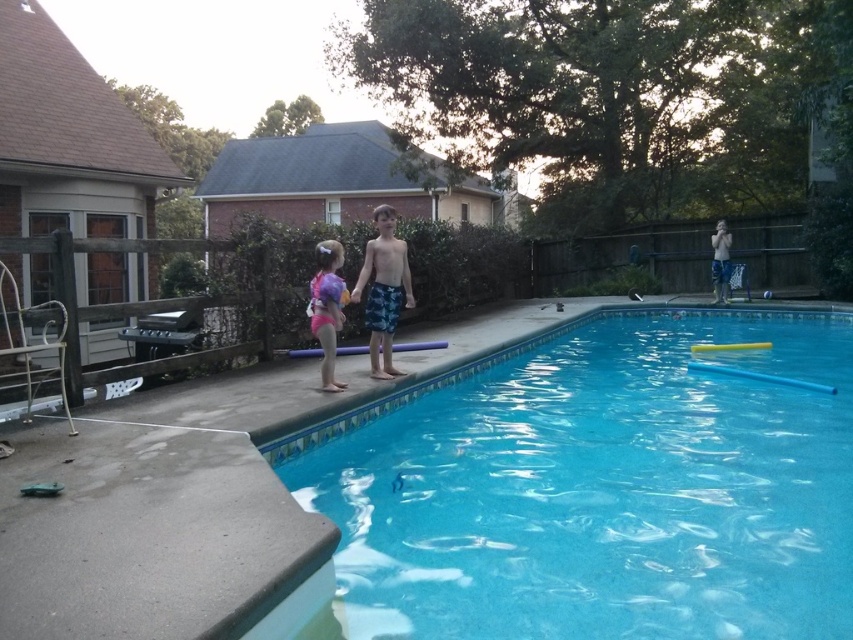
Question: Which object is closer to the camera taking this photo?

Choices:
 (A) pink fabric swimsuit at center
 (B) blue textured shorts at upper right

Answer: (A)

Question: Is the position of clear blue water at center less distant than that of pink fabric swimsuit at center?

Choices:
 (A) no
 (B) yes

Answer: (B)

Question: Can you confirm if blue printed shorts at center is positioned to the left of pink fabric swimsuit at center?

Choices:
 (A) yes
 (B) no

Answer: (B)

Question: Which of the following is the farthest from the observer?

Choices:
 (A) blue textured shorts at upper right
 (B) clear blue water at center
 (C) pink fabric swimsuit at center

Answer: (A)

Question: Does pink fabric swimsuit at center come in front of blue textured shorts at upper right?

Choices:
 (A) no
 (B) yes

Answer: (B)

Question: Which object appears closest to the camera in this image?

Choices:
 (A) blue printed shorts at center
 (B) blue textured shorts at upper right
 (C) pink fabric swimsuit at center

Answer: (C)